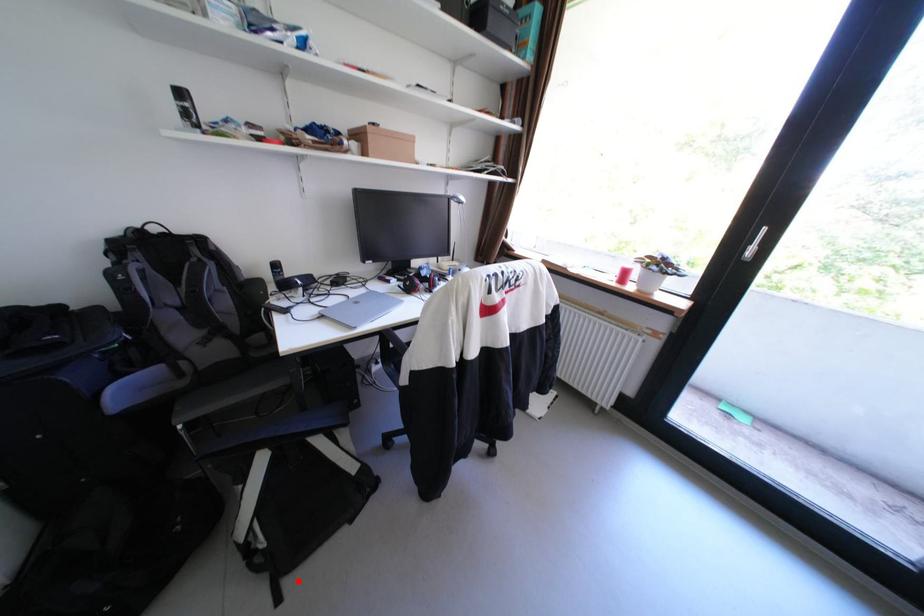
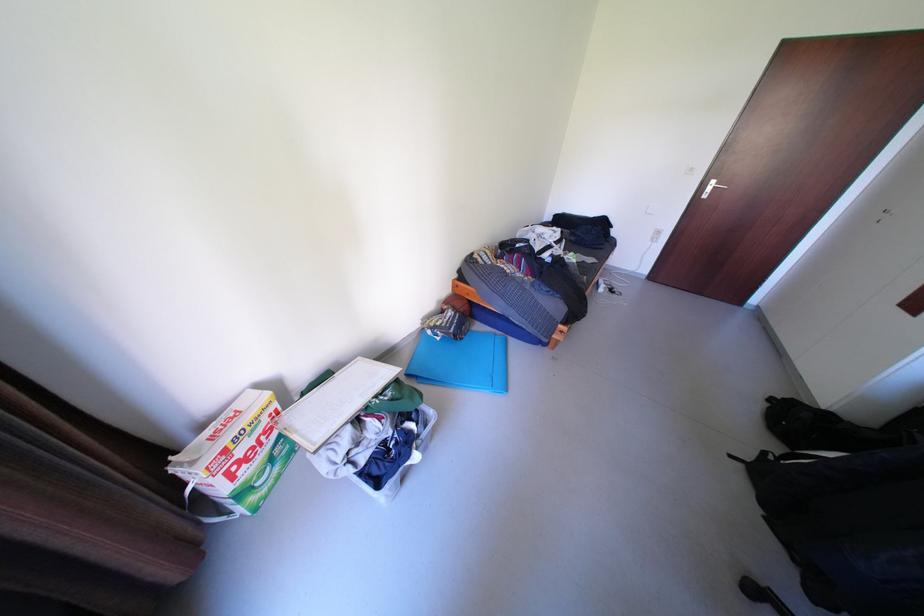
In the second image, find the point that corresponds to the highlighted location in the first image.

(752, 466)